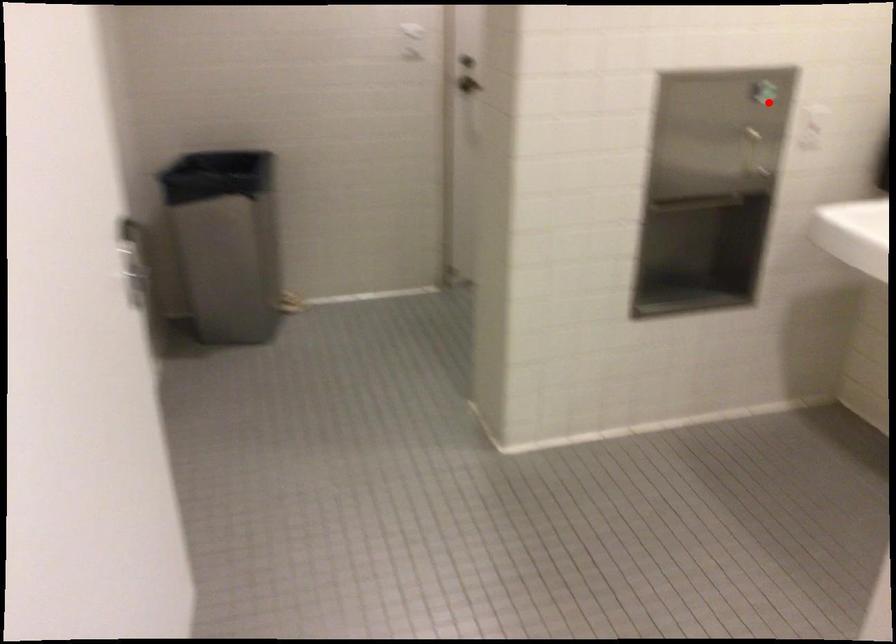
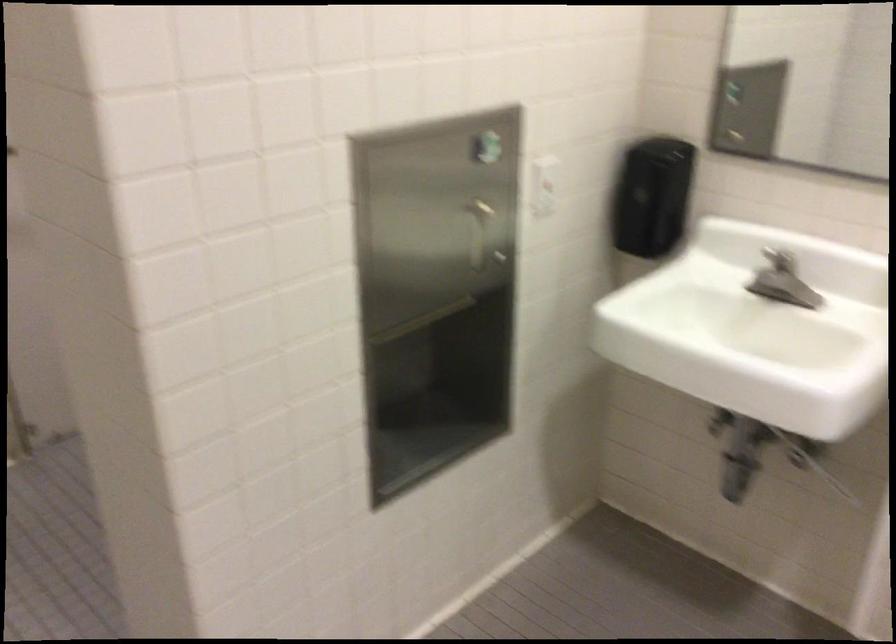
Locate, in the second image, the point that corresponds to the highlighted location in the first image.

(493, 175)